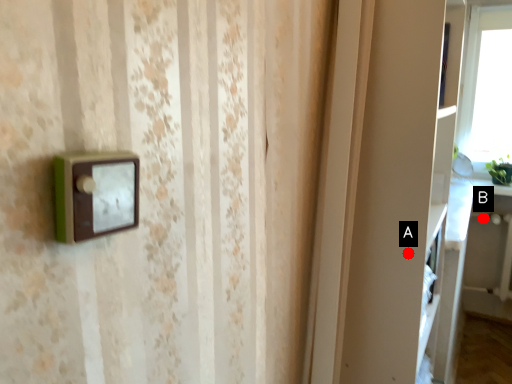
Question: Two points are circled on the image, labeled by A and B beside each circle. Among these points, which one is farthest from the camera?

Choices:
 (A) A is further
 (B) B is further

Answer: (B)